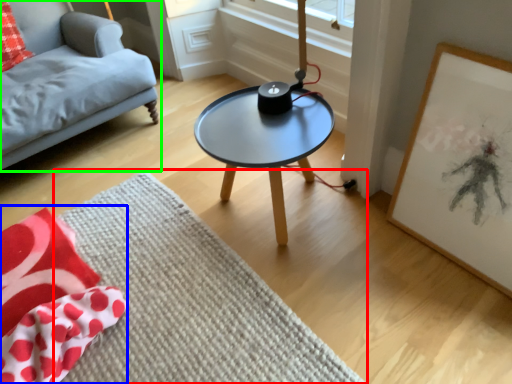
Question: Considering the real-world distances, which object is closest to mat (highlighted by a red box)? blanket (highlighted by a blue box) or studio couch (highlighted by a green box).

Choices:
 (A) blanket
 (B) studio couch

Answer: (A)